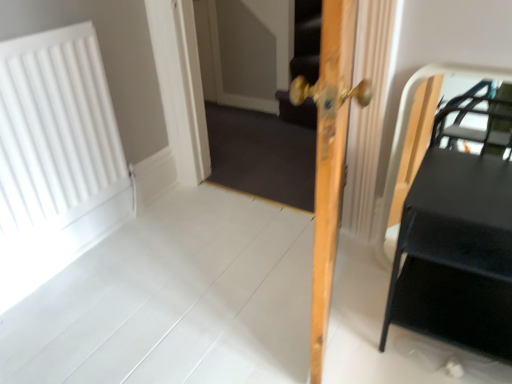
Question: Is white matte radiator at left in front of or behind black matte table at right in the image?

Choices:
 (A) behind
 (B) front

Answer: (A)

Question: From the image's perspective, is white matte radiator at left positioned above or below black matte table at right?

Choices:
 (A) above
 (B) below

Answer: (A)

Question: Which object is the closest to the light wood door at center?

Choices:
 (A) black matte table at right
 (B) wooden screen door at center
 (C) white matte radiator at left

Answer: (A)

Question: Based on their relative distances, which object is nearer to the white matte radiator at left?

Choices:
 (A) light wood door at center
 (B) black matte table at right
 (C) wooden screen door at center

Answer: (A)